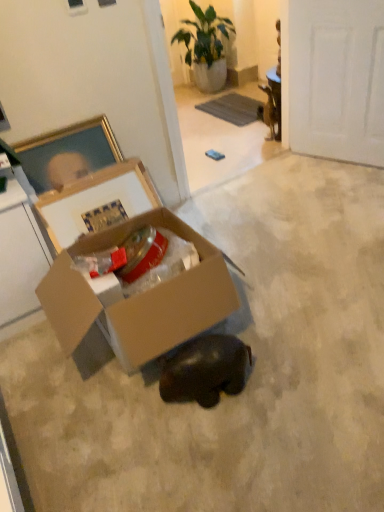
You are a GUI agent. You are given a task and a screenshot of the screen. Output one action in this format:
    pyautogui.click(x=<x>, y=<y>)
    Task: Click on the vacant area that is in front of cardboard box at center
    
    Given the screenshot: What is the action you would take?
    pyautogui.click(x=188, y=451)